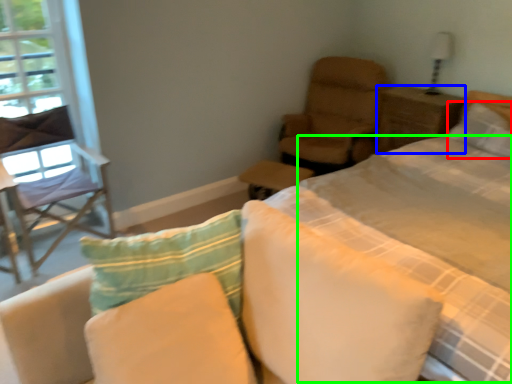
Question: Estimate the real-world distances between objects in this image. Which object is farther from pillow (highlighted by a red box), nightstand (highlighted by a blue box) or quilt (highlighted by a green box)?

Choices:
 (A) nightstand
 (B) quilt

Answer: (B)